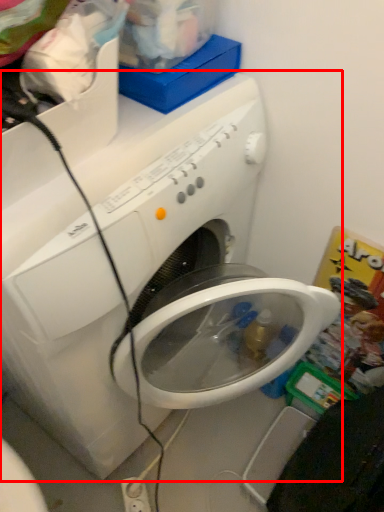
Question: From the image's perspective, what is the correct spatial relationship of washing machine (annotated by the red box) in relation to electric outlet?

Choices:
 (A) below
 (B) above

Answer: (B)